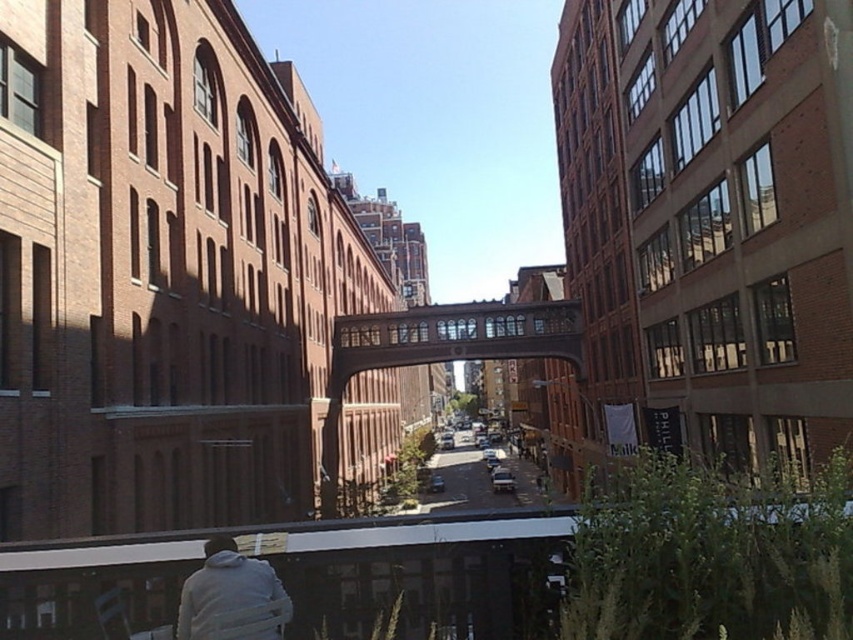
Who is lower down, light gray hoodie at lower left or smooth asphalt road at center?

smooth asphalt road at center is lower down.

Does point (223, 552) come farther from viewer compared to point (503, 493)?

No, (223, 552) is in front of (503, 493).

This screenshot has width=853, height=640. I want to click on light gray hoodie at lower left, so click(223, 586).